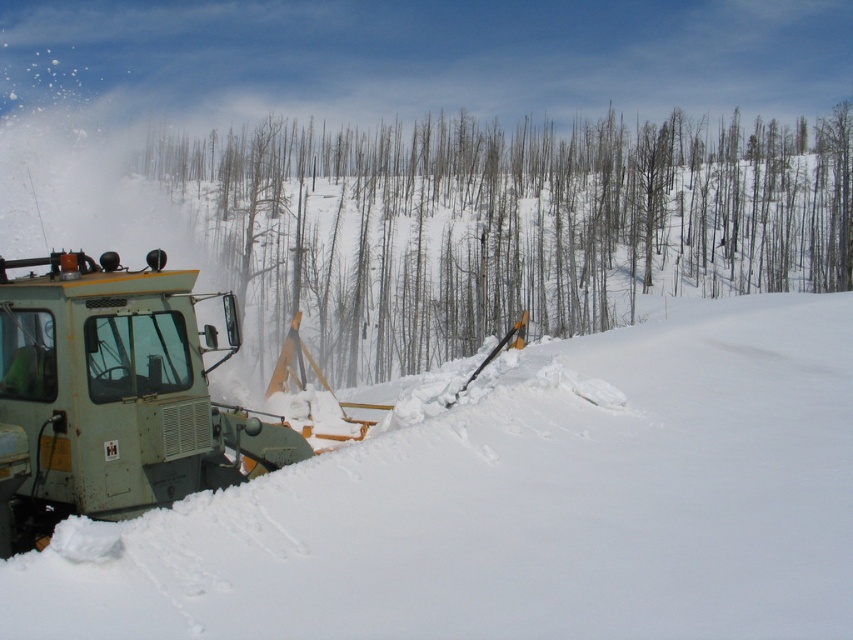
Question: Can you confirm if white powdery snow at lower left is wider than gray bark trees at center?

Choices:
 (A) no
 (B) yes

Answer: (A)

Question: Which point is closer to the camera taking this photo?

Choices:
 (A) (155, 496)
 (B) (636, 340)
 (C) (369, 150)

Answer: (A)

Question: Is white powdery snow at lower left below green matte snowplow at lower left?

Choices:
 (A) yes
 (B) no

Answer: (A)

Question: Which object is the farthest from the white powdery snow at lower left?

Choices:
 (A) gray bark trees at center
 (B) green matte snowplow at lower left

Answer: (A)

Question: Is white powdery snow at lower left below gray bark trees at center?

Choices:
 (A) yes
 (B) no

Answer: (A)

Question: Among these points, which one is farthest from the camera?

Choices:
 (A) (720, 212)
 (B) (741, 499)

Answer: (A)